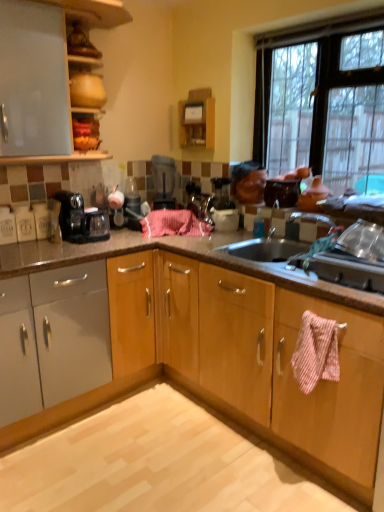
Question: From a real-world perspective, does metallic silver sink at right stand above black plastic blender at center?

Choices:
 (A) no
 (B) yes

Answer: (A)

Question: Is metallic silver sink at right wider than black plastic blender at center?

Choices:
 (A) no
 (B) yes

Answer: (A)

Question: Would you say black plastic blender at center is part of metallic silver sink at right's contents?

Choices:
 (A) yes
 (B) no

Answer: (B)

Question: Is metallic silver sink at right bigger than black plastic blender at center?

Choices:
 (A) yes
 (B) no

Answer: (B)

Question: From a real-world perspective, is metallic silver sink at right below black plastic blender at center?

Choices:
 (A) yes
 (B) no

Answer: (A)

Question: From a real-world perspective, relative to pink striped towel at lower right, acting as the 1th blanket starting from the right, is black plastic coffee maker at left vertically above or below?

Choices:
 (A) above
 (B) below

Answer: (A)

Question: Based on their sizes in the image, would you say black plastic coffee maker at left is bigger or smaller than pink striped towel at lower right, which appears as the first blanket when ordered from the bottom?

Choices:
 (A) big
 (B) small

Answer: (A)

Question: Is black plastic coffee maker at left taller or shorter than pink striped towel at lower right, which appears as the first blanket when ordered from the bottom?

Choices:
 (A) short
 (B) tall

Answer: (A)

Question: Is black plastic coffee maker at left wider or thinner than pink striped towel at lower right, which is the 2th blanket from top to bottom?

Choices:
 (A) wide
 (B) thin

Answer: (A)

Question: Is matte white cabinet at upper left inside the boundaries of light brown polished granite at lower center, or outside?

Choices:
 (A) outside
 (B) inside

Answer: (A)

Question: From a real-world perspective, relative to light brown polished granite at lower center, is matte white cabinet at upper left vertically above or below?

Choices:
 (A) above
 (B) below

Answer: (A)

Question: Considering the positions of matte white cabinet at upper left and light brown polished granite at lower center in the image, is matte white cabinet at upper left taller or shorter than light brown polished granite at lower center?

Choices:
 (A) short
 (B) tall

Answer: (B)

Question: Looking at their shapes, would you say matte white cabinet at upper left is wider or thinner than light brown polished granite at lower center?

Choices:
 (A) thin
 (B) wide

Answer: (A)

Question: Considering the positions of clear glass window at upper right and matte white cabinet at upper left in the image, is clear glass window at upper right taller or shorter than matte white cabinet at upper left?

Choices:
 (A) tall
 (B) short

Answer: (A)

Question: Considering the relative positions of clear glass window at upper right and matte white cabinet at upper left in the image provided, is clear glass window at upper right to the left or to the right of matte white cabinet at upper left?

Choices:
 (A) left
 (B) right

Answer: (B)